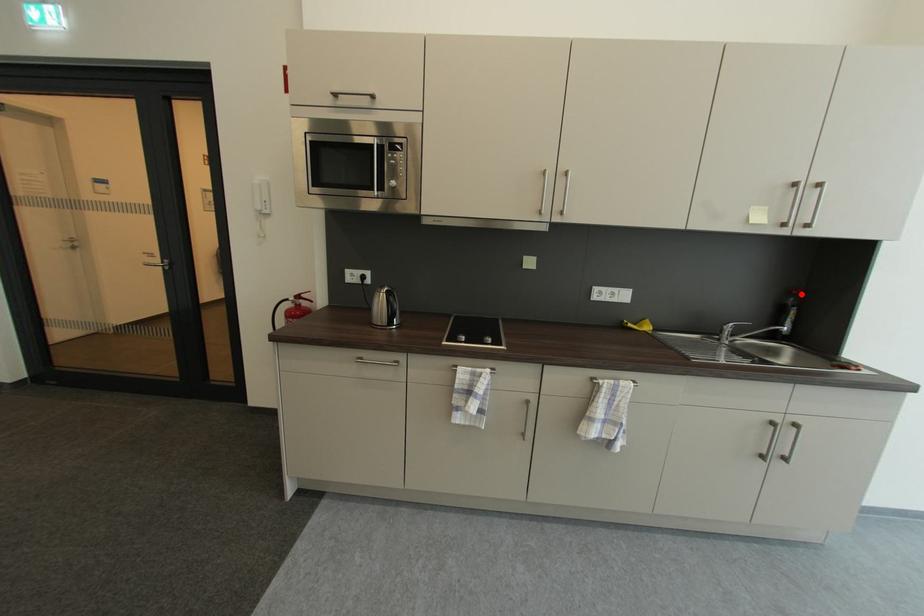
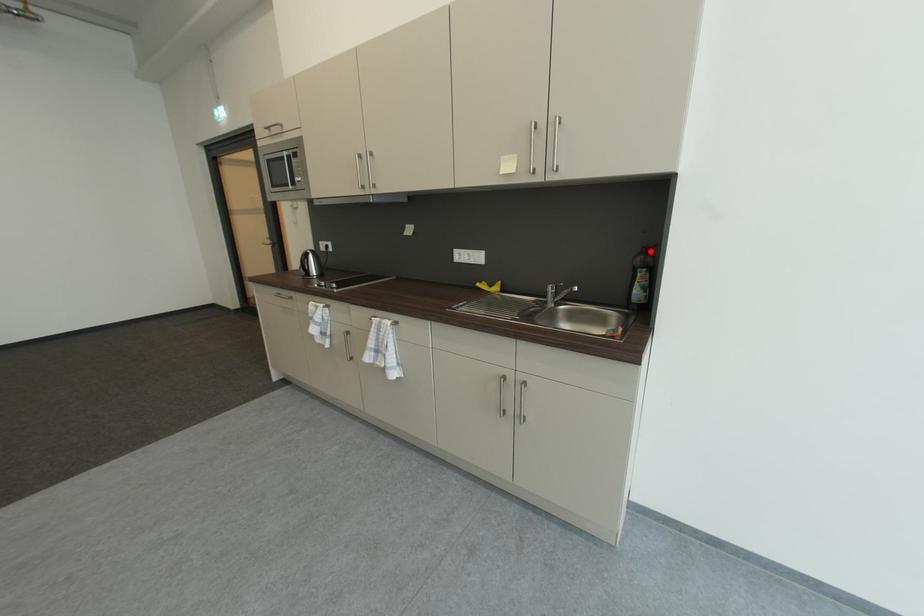
I am providing you with two images of the same scene from different viewpoints. A red point is marked on the first image and another point is marked on the second image. Is the red point in image1 aligned with the point shown in image2?

Yes